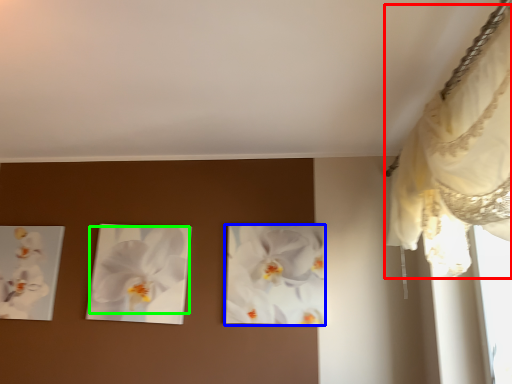
Question: Which object is the closest to the curtain (highlighted by a red box)? Choose among these: flower (highlighted by a blue box) or flower (highlighted by a green box).

Choices:
 (A) flower
 (B) flower

Answer: (A)